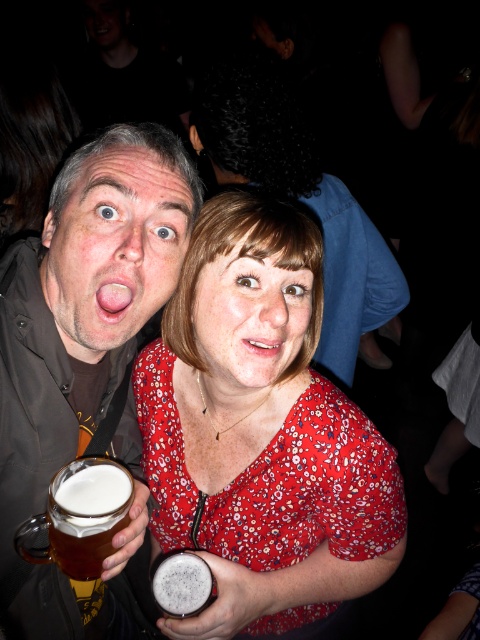
Can you confirm if matte floral dress at center is bigger than foamy white beer at center?

Indeed, matte floral dress at center has a larger size compared to foamy white beer at center.

Can you confirm if matte floral dress at center is positioned to the right of foamy white beer at center?

Indeed, matte floral dress at center is positioned on the right side of foamy white beer at center.

Where is `matte floral dress at center`? The width and height of the screenshot is (480, 640). matte floral dress at center is located at coordinates (262, 422).

In order to click on matte floral dress at center in this screenshot , I will do `click(262, 422)`.

Is translucent glass mug at lower left to the right of foamy white beer at center from the viewer's perspective?

Incorrect, translucent glass mug at lower left is not on the right side of foamy white beer at center.

Does translucent glass mug at lower left have a smaller size compared to foamy white beer at center?

No.

Identify the location of translucent glass mug at lower left. (79, 516).

You are a GUI agent. You are given a task and a screenshot of the screen. Output one action in this format:
    pyautogui.click(x=<x>, y=<y>)
    Task: Click on the translucent glass mug at lower left
    
    Given the screenshot: What is the action you would take?
    pyautogui.click(x=79, y=516)

Between red floral blouse at center and foamy white beer at center, which one has less height?

With less height is foamy white beer at center.

Is red floral blouse at center shorter than foamy white beer at center?

No.

Who is more forward, (x=249, y=330) or (x=200, y=611)?

Positioned in front is point (x=249, y=330).

Find the location of a particular element. red floral blouse at center is located at coordinates (x=251, y=321).